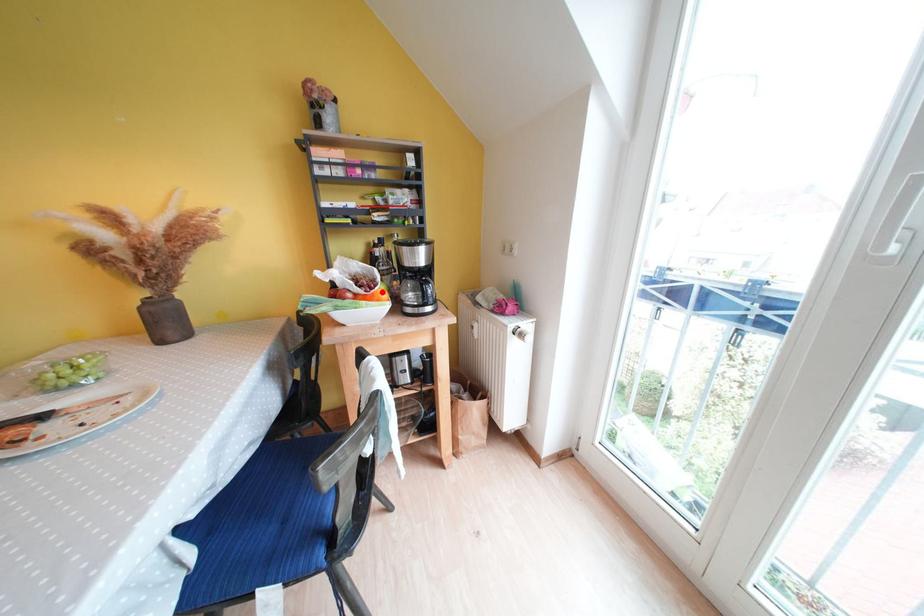
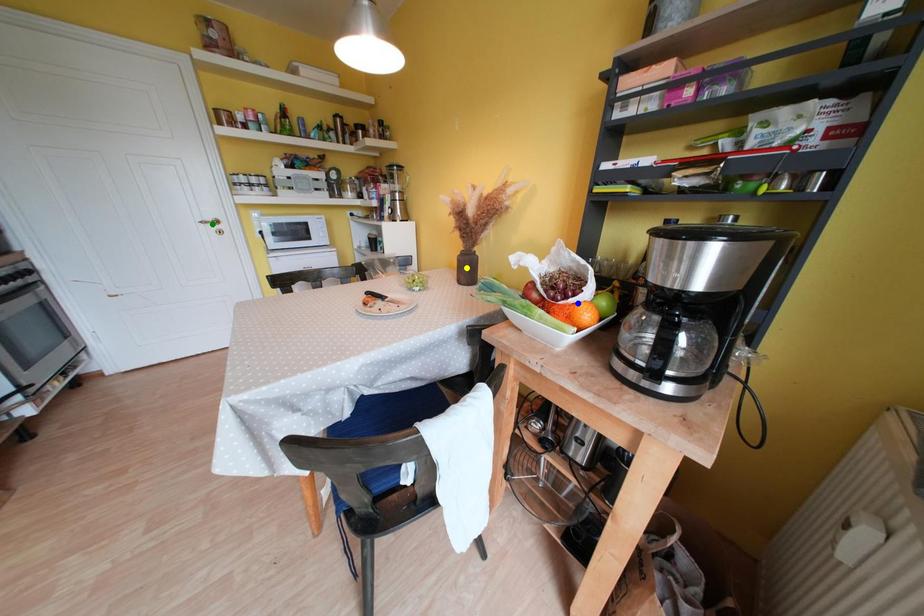
Question: I am providing you with two images of the same scene from different viewpoints. A red point is marked on the first image. You are given multiple points on the second image. Which mark in image 2 goes with the point in image 1?

Choices:
 (A) yellow point
 (B) green point
 (C) blue point

Answer: (C)